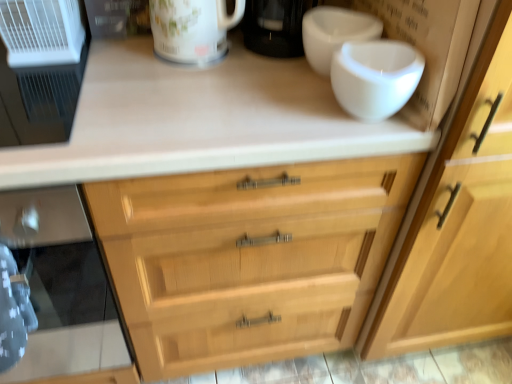
Question: Is black glass oven at left bigger or smaller than glossy ceramic mug at upper center?

Choices:
 (A) small
 (B) big

Answer: (B)

Question: From the image's perspective, is black glass oven at left above or below glossy ceramic mug at upper center?

Choices:
 (A) below
 (B) above

Answer: (A)

Question: Which is farther from the black glass oven at left?

Choices:
 (A) white glossy bowl at upper right
 (B) glossy ceramic mug at upper center
 (C) white plastic air purifier at left, which appears as the second appliance when viewed from the top
 (D) white plastic cage at upper left, the first appliance in the top-to-bottom sequence

Answer: (A)

Question: Which object is positioned farthest from the white glossy bowl at upper right?

Choices:
 (A) glossy ceramic mug at upper center
 (B) white plastic cage at upper left, which is counted as the second appliance, starting from the bottom
 (C) white plastic air purifier at left, which is the 1th appliance from bottom to top
 (D) black glass oven at left

Answer: (D)